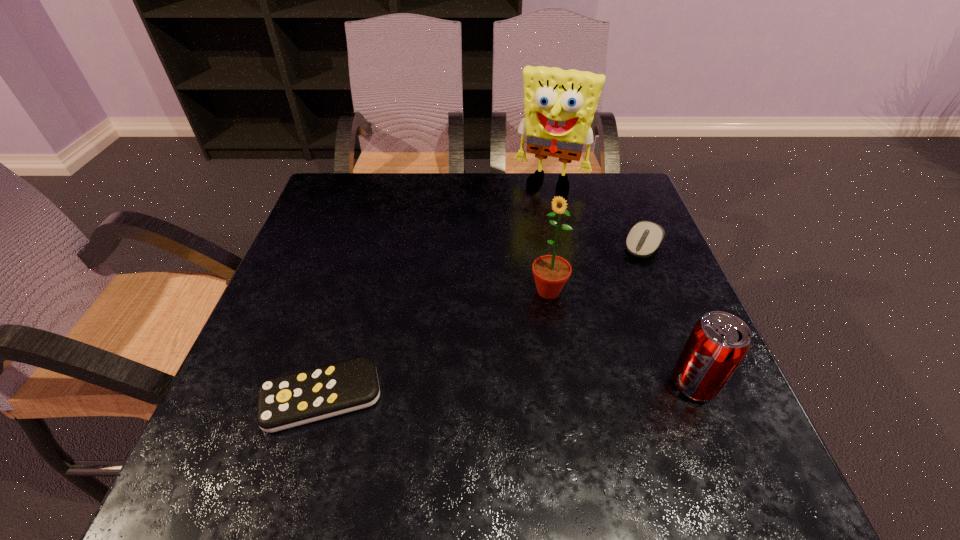
Where is `free spot that satisfies the following two spatial constraints: 1. on the back side of the leftmost object; 2. on the right side of the soda can`? free spot that satisfies the following two spatial constraints: 1. on the back side of the leftmost object; 2. on the right side of the soda can is located at coordinates (325, 384).